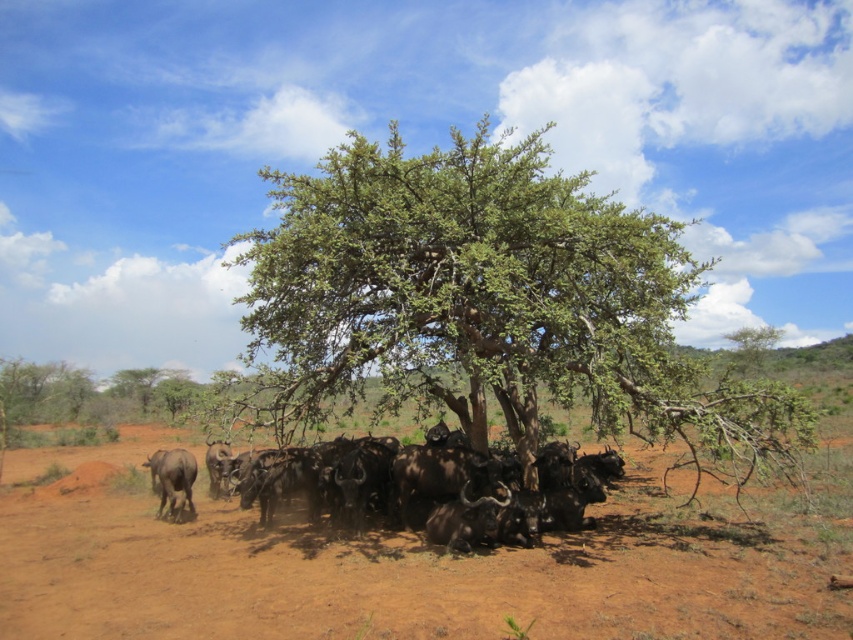
You are planning to set up a small tent for a wildlife observation station. The tent requires a flat area larger than the black glossy buffalo at lower center. Is the brown dirt field at center suitable for this purpose?

The brown dirt field at center is bigger than the black glossy buffalo at lower center, so yes, the brown dirt field at center is suitable for setting up the tent as it provides a larger flat area.

You are a wildlife photographer trying to capture a photo of the black glossy buffalo at lower center and the brown rough yak at lower left. Which animal will appear smaller in your photo?

The black glossy buffalo at lower center will appear smaller in the photo because it occupies less space than the brown rough yak at lower left.